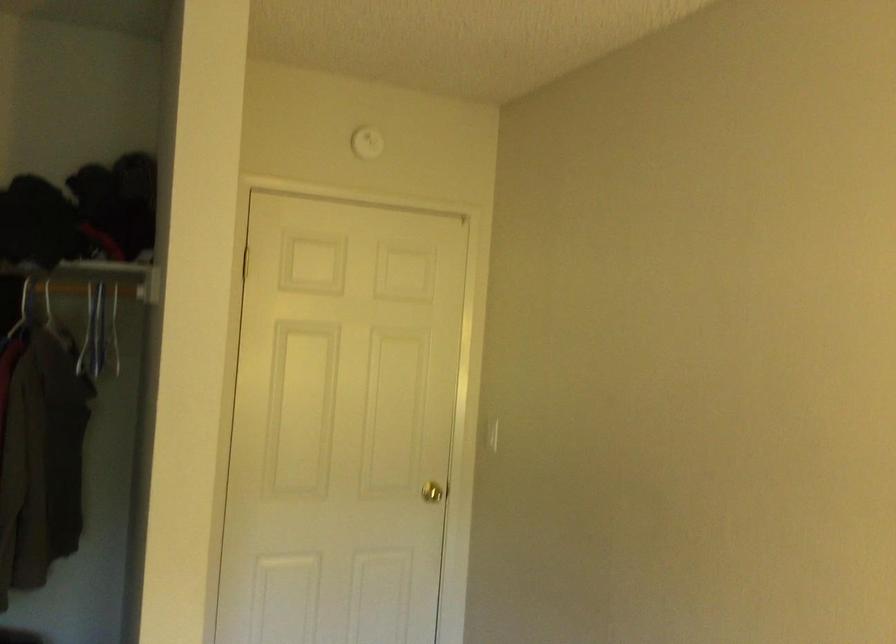
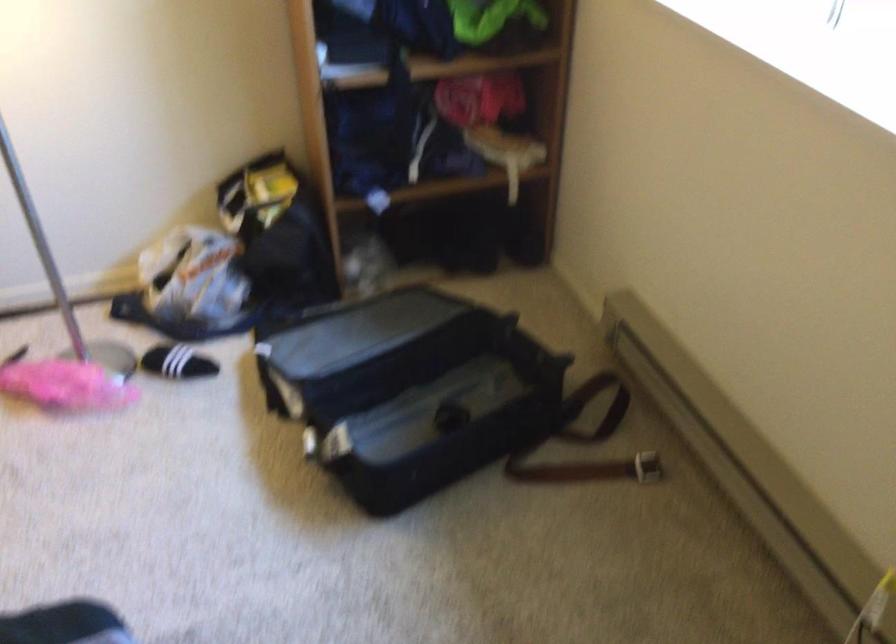
From the picture: Based on the continuous images, in which direction is the camera rotating?

The camera rotated toward right-down.